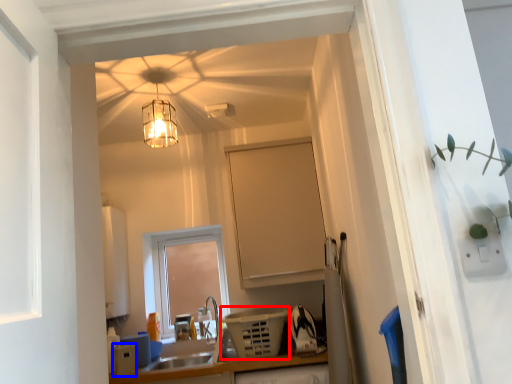
Question: Which of the following is the farthest to the observer, appliance (highlighted by a red box) or appliance (highlighted by a blue box)?

Choices:
 (A) appliance
 (B) appliance

Answer: (B)